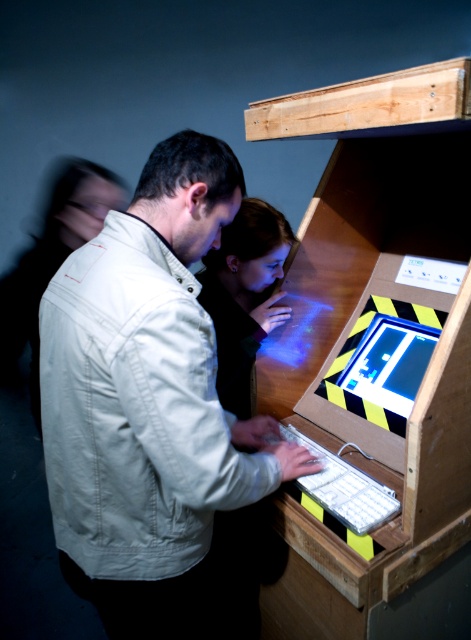
You are a game developer who wants to place a promotional sticker between the light beige jacket at center and the white plastic keyboard at lower center. The sticker is 15 inches long. Will it fit between them without overlapping either object?

The distance between the light beige jacket at center and the white plastic keyboard at lower center is 14.93 inches. Since the sticker is 15 inches long, it will not fit without overlapping one of the objects.

You are standing in front of the arcade machine and want to use the white plastic keyboard at lower center. However, the light beige jacket at center is blocking your access. Can you move around the jacket to reach the keyboard?

The white plastic keyboard at lower center is behind the light beige jacket at center, so you can move around to the front of the jacket to access the keyboard.